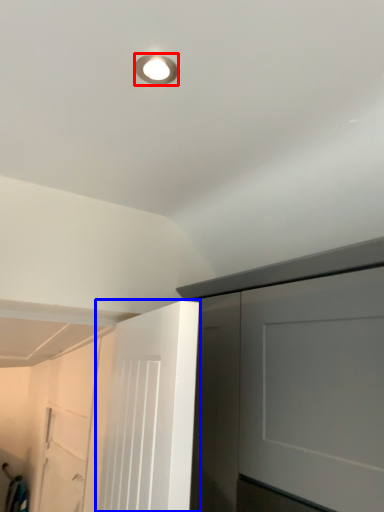
Question: Which point is closer to the camera, droplight (highlighted by a red box) or door (highlighted by a blue box)?

Choices:
 (A) droplight
 (B) door

Answer: (B)